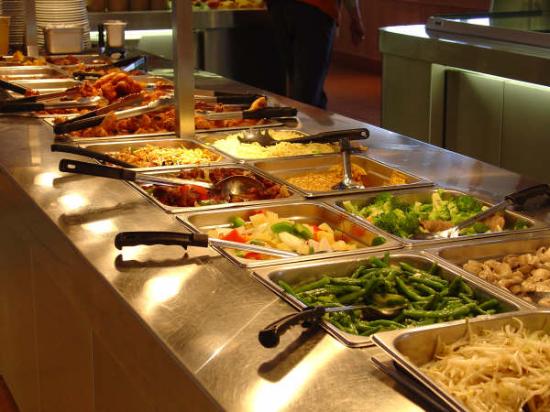
Where is `floor`? The image size is (550, 412). floor is located at coordinates (344, 84).